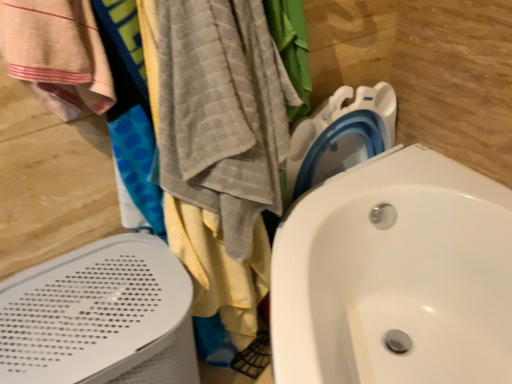
How much space does gray textured towel at left, which is the first beach towel in right-to-left order, occupy vertically?

23.80 inches.

Where is `white perforated bath heater at left`? The image size is (512, 384). white perforated bath heater at left is located at coordinates (100, 317).

Is beige woven towel at left, positioned as the first beach towel in left-to-right order, completely or partially outside of white glossy sink at center?

Yes.

Is beige woven towel at left, which is the 2th beach towel from right to left, positioned with its back to white glossy sink at center?

That's not correct — beige woven towel at left, which is the 2th beach towel from right to left, is not looking away from white glossy sink at center.

Between beige woven towel at left, positioned as the first beach towel in left-to-right order, and white glossy sink at center, which one appears on the right side from the viewer's perspective?

Positioned to the right is white glossy sink at center.

Does beige woven towel at left, positioned as the first beach towel in left-to-right order, have a greater height compared to gray textured towel at left, which is the first beach towel in right-to-left order?

No.

Is beige woven towel at left, which is the 2th beach towel from right to left, far away from gray textured towel at left, acting as the 2th beach towel starting from the left?

They are positioned close to each other.

Is beige woven towel at left, positioned as the first beach towel in left-to-right order, facing away from gray textured towel at left, acting as the 2th beach towel starting from the left?

No, beige woven towel at left, positioned as the first beach towel in left-to-right order,'s orientation is not away from gray textured towel at left, acting as the 2th beach towel starting from the left.

Is white perforated bath heater at left looking in the opposite direction of beige woven towel at left, positioned as the first beach towel in left-to-right order?

No, white perforated bath heater at left's orientation is not away from beige woven towel at left, positioned as the first beach towel in left-to-right order.

Would you say white perforated bath heater at left is to the left or to the right of beige woven towel at left, positioned as the first beach towel in left-to-right order, in the picture?

Clearly, white perforated bath heater at left is on the left of beige woven towel at left, positioned as the first beach towel in left-to-right order, in the image.

Is white perforated bath heater at left positioned far away from beige woven towel at left, which is the 2th beach towel from right to left?

That's not correct — white perforated bath heater at left is a little close to beige woven towel at left, which is the 2th beach towel from right to left.

Would you say white perforated bath heater at left is part of white glossy sink at center's contents?

No, white perforated bath heater at left is not inside white glossy sink at center.

Between white glossy sink at center and white perforated bath heater at left, which one has larger size?

With larger size is white glossy sink at center.

From the image's perspective, does white glossy sink at center appear higher than white perforated bath heater at left?

Yes, from the image's perspective, white glossy sink at center is on top of white perforated bath heater at left.

How different are the orientations of white glossy sink at center and white perforated bath heater at left in degrees?

They differ by 88.3 degrees in their facing directions.

Is white perforated bath heater at left oriented towards white glossy sink at center?

No, white perforated bath heater at left is not facing towards white glossy sink at center.

Is white perforated bath heater at left completely or partially outside of white glossy sink at center?

Absolutely, white perforated bath heater at left is external to white glossy sink at center.

From a real-world perspective, does white perforated bath heater at left sit lower than white glossy sink at center?

Incorrect, from a real-world perspective, white perforated bath heater at left is higher than white glossy sink at center.

Where is `sink below the white perforated bath heater at left (from a real-world perspective)`? sink below the white perforated bath heater at left (from a real-world perspective) is located at coordinates (395, 276).

Is gray textured towel at left, which is the first beach towel in right-to-left order, not within white glossy sink at center?

Yes, gray textured towel at left, which is the first beach towel in right-to-left order, is not within white glossy sink at center.

Considering the relative sizes of gray textured towel at left, acting as the 2th beach towel starting from the left, and white glossy sink at center in the image provided, is gray textured towel at left, acting as the 2th beach towel starting from the left, taller than white glossy sink at center?

Yes.

Is the position of gray textured towel at left, acting as the 2th beach towel starting from the left, more distant than that of white glossy sink at center?

Yes, it is.

From the image's perspective, between gray textured towel at left, which is the first beach towel in right-to-left order, and white perforated bath heater at left, which one is located above?

gray textured towel at left, which is the first beach towel in right-to-left order, from the image's perspective.

Is gray textured towel at left, acting as the 2th beach towel starting from the left, far from white perforated bath heater at left?

They are positioned close to each other.

At what (x,y) coordinates should I click in order to perform the action: click on sink that appears below the beige woven towel at left, which is the 2th beach towel from right to left (from the image's perspective). Please return your answer as a coordinate pair (x, y). The image size is (512, 384). Looking at the image, I should click on (395, 276).

Locate an element on the screen. This screenshot has width=512, height=384. beach towel that is in front of the gray textured towel at left, acting as the 2th beach towel starting from the left is located at coordinates (57, 54).

Based on their spatial positions, is white perforated bath heater at left or gray textured towel at left, acting as the 2th beach towel starting from the left, closer to white glossy sink at center?

The object closer to white glossy sink at center is gray textured towel at left, acting as the 2th beach towel starting from the left.

Looking at the image, which one is located closer to beige woven towel at left, positioned as the first beach towel in left-to-right order, white glossy sink at center or white perforated bath heater at left?

white perforated bath heater at left lies closer to beige woven towel at left, positioned as the first beach towel in left-to-right order, than the other object.

Looking at the image, which one is located closer to white perforated bath heater at left, white glossy sink at center or beige woven towel at left, which is the 2th beach towel from right to left?

beige woven towel at left, which is the 2th beach towel from right to left.

Based on the photo, when comparing their distances from gray textured towel at left, acting as the 2th beach towel starting from the left, does beige woven towel at left, positioned as the first beach towel in left-to-right order, or white glossy sink at center seem closer?

beige woven towel at left, positioned as the first beach towel in left-to-right order.

Looking at the image, which one is located closer to white glossy sink at center, gray textured towel at left, which is the first beach towel in right-to-left order, or white perforated bath heater at left?

Based on the image, gray textured towel at left, which is the first beach towel in right-to-left order, appears to be nearer to white glossy sink at center.

Looking at the image, which one is located closer to gray textured towel at left, acting as the 2th beach towel starting from the left, beige woven towel at left, positioned as the first beach towel in left-to-right order, or white perforated bath heater at left?

beige woven towel at left, positioned as the first beach towel in left-to-right order.

From the image, which object appears to be nearer to white perforated bath heater at left, white glossy sink at center or gray textured towel at left, acting as the 2th beach towel starting from the left?

gray textured towel at left, acting as the 2th beach towel starting from the left.

Based on their spatial positions, is white glossy sink at center or beige woven towel at left, positioned as the first beach towel in left-to-right order, further from gray textured towel at left, acting as the 2th beach towel starting from the left?

Based on the image, white glossy sink at center appears to be further to gray textured towel at left, acting as the 2th beach towel starting from the left.

The height and width of the screenshot is (384, 512). In order to click on beach towel that lies between beige woven towel at left, which is the 2th beach towel from right to left, and white perforated bath heater at left from top to bottom in this screenshot , I will do [x=222, y=112].

Where is `sink between beige woven towel at left, which is the 2th beach towel from right to left, and white perforated bath heater at left vertically`? The width and height of the screenshot is (512, 384). sink between beige woven towel at left, which is the 2th beach towel from right to left, and white perforated bath heater at left vertically is located at coordinates (395, 276).

Find the location of a particular element. The height and width of the screenshot is (384, 512). beach towel between beige woven towel at left, positioned as the first beach towel in left-to-right order, and white glossy sink at center vertically is located at coordinates (x=222, y=112).